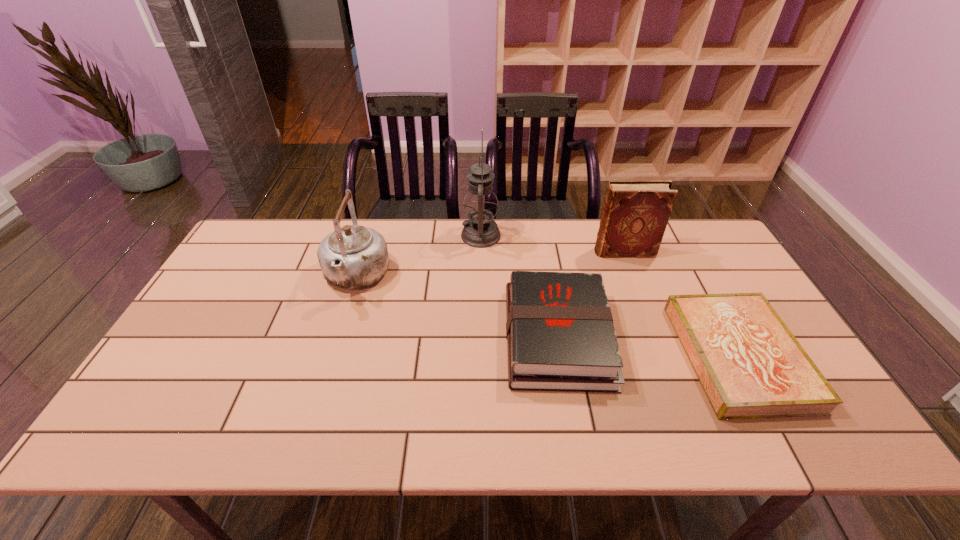
Locate an element on the screen. empty space that is in between the oil lamp and the leftmost object is located at coordinates (419, 256).

I want to click on vacant space that's between the shortest hardback book and the leftmost hardback book, so click(x=648, y=347).

Locate which object ranks in proximity to the tallest object. Please provide its 2D coordinates. Your answer should be formatted as a tuple, i.e. [(x, y)], where the tuple contains the x and y coordinates of a point satisfying the conditions above.

[(560, 335)]

Locate which object is the fourth closest to the tallest object. Please provide its 2D coordinates. Your answer should be formatted as a tuple, i.e. [(x, y)], where the tuple contains the x and y coordinates of a point satisfying the conditions above.

[(750, 365)]

I want to click on hardback book that is the second closest to the tallest object, so click(635, 214).

Find the location of `hardback book that is the second closest to the leftmost hardback book`. hardback book that is the second closest to the leftmost hardback book is located at coordinates (750, 365).

Locate an element on the screen. This screenshot has width=960, height=540. free region that satisfies the following two spatial constraints: 1. on the spine side of the tallest hardback book; 2. at the spout of the kettle is located at coordinates (634, 277).

Where is `vacant space that satisfies the following two spatial constraints: 1. on the spine side of the farthest hardback book; 2. on the back side of the shortest hardback book`? vacant space that satisfies the following two spatial constraints: 1. on the spine side of the farthest hardback book; 2. on the back side of the shortest hardback book is located at coordinates (664, 356).

The width and height of the screenshot is (960, 540). Identify the location of free space that satisfies the following two spatial constraints: 1. on the spine side of the farthest hardback book; 2. at the spout of the leftmost object. (634, 277).

The width and height of the screenshot is (960, 540). In order to click on free location that satisfies the following two spatial constraints: 1. on the spine side of the tallest hardback book; 2. on the back side of the shortest hardback book in this screenshot , I will do `click(664, 356)`.